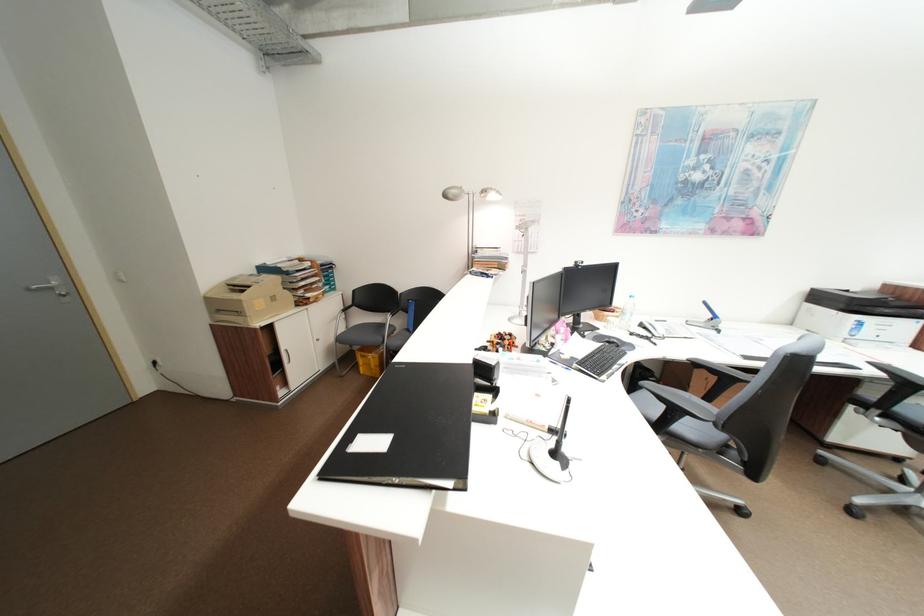
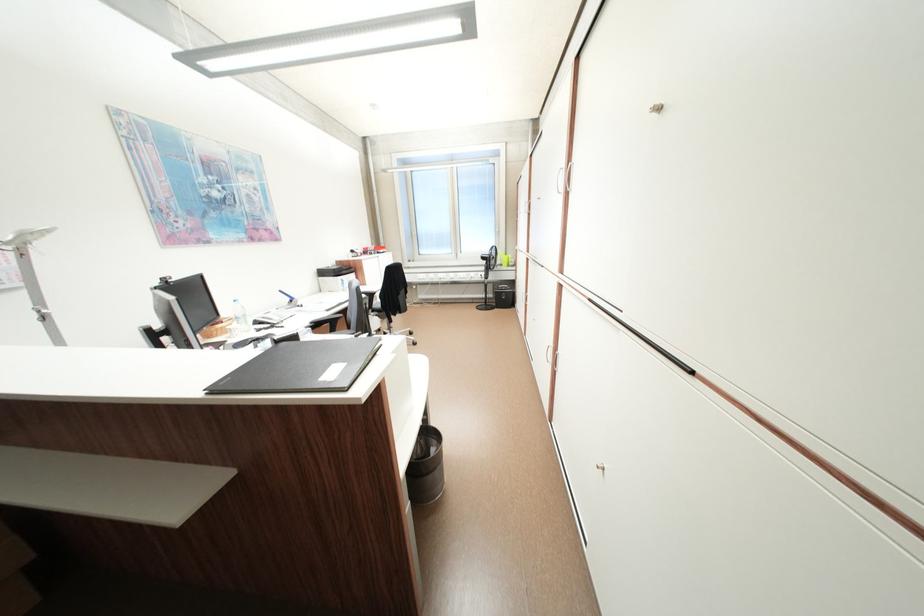
In the second image, find the point that corresponds to [665,323] in the first image.

(275, 317)